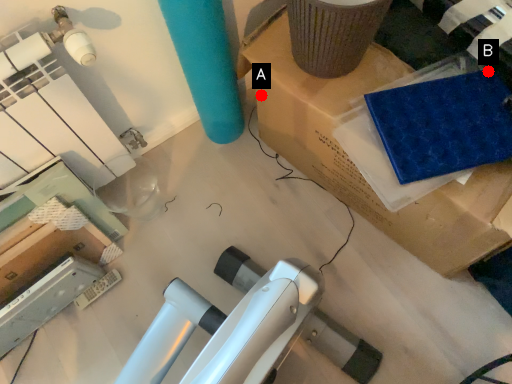
Question: Two points are circled on the image, labeled by A and B beside each circle. Which point is closer to the camera taking this photo?

Choices:
 (A) A is closer
 (B) B is closer

Answer: (B)